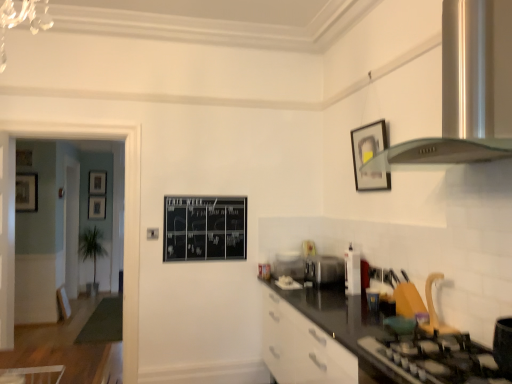
Question: Does point (475, 97) appear closer or farther from the camera than point (224, 210)?

Choices:
 (A) farther
 (B) closer

Answer: (B)

Question: Considering the relative positions of satin silver exhaust hood at upper right and black chalkboard at center in the image provided, is satin silver exhaust hood at upper right to the left or to the right of black chalkboard at center?

Choices:
 (A) left
 (B) right

Answer: (B)

Question: Estimate the real-world distances between objects in this image. Which object is closer to the matte black picture frame at center, the fourth picture frame in the left-to-right sequence?

Choices:
 (A) white glossy toaster at right, placed as the first appliance when sorted from front to back
 (B) black matte gas stove at lower right
 (C) wooden picture frame at left, which is counted as the 3th picture frame, starting from the front
 (D) matte black picture frame at upper right, marked as the 5th picture frame in a left-to-right arrangement
 (E) matte black picture frame at upper left, marked as the first picture frame in a back-to-front arrangement

Answer: (E)

Question: Estimate the real-world distances between objects in this image. Which object is closer to the matte black picture frame at upper left, the 3th picture frame when ordered from right to left?

Choices:
 (A) black chalkboard at center
 (B) matte black picture frame at upper right, the 1th picture frame when ordered from right to left
 (C) satin silver toaster at center, the second appliance viewed from the front
 (D) clear plastic container at center, positioned as the first appliance in left-to-right order
 (E) white glossy toaster at right, the first appliance viewed from the right

Answer: (A)